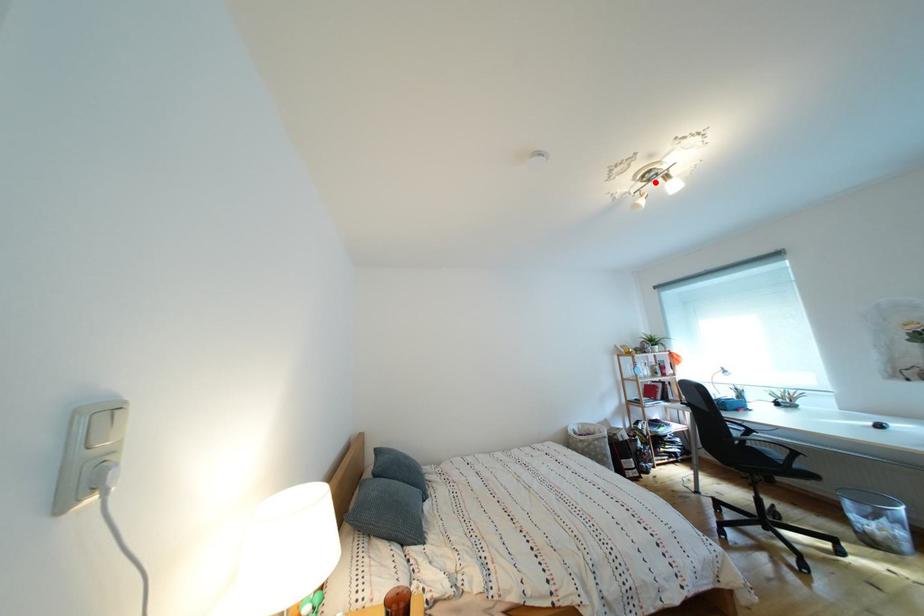
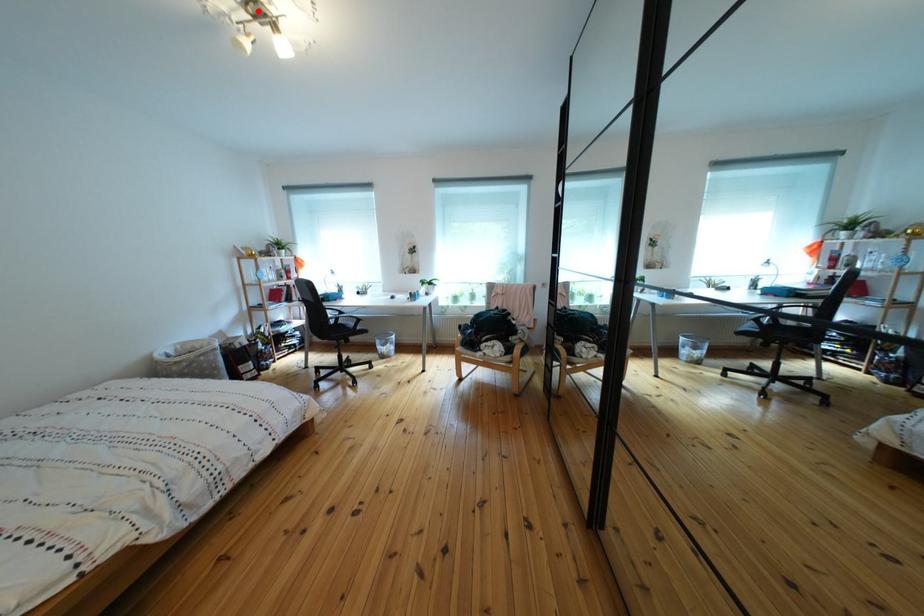
I am providing you with two images of the same scene from different viewpoints. A red point is marked on the first image and another point is marked on the second image. Does the point marked in image1 correspond to the same location as the one in image2?

Yes